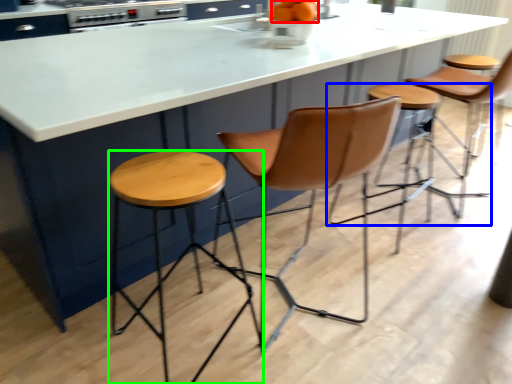
Question: Which is farther away from orange (highlighted by a red box)? stool (highlighted by a blue box) or stool (highlighted by a green box)?

Choices:
 (A) stool
 (B) stool

Answer: (A)